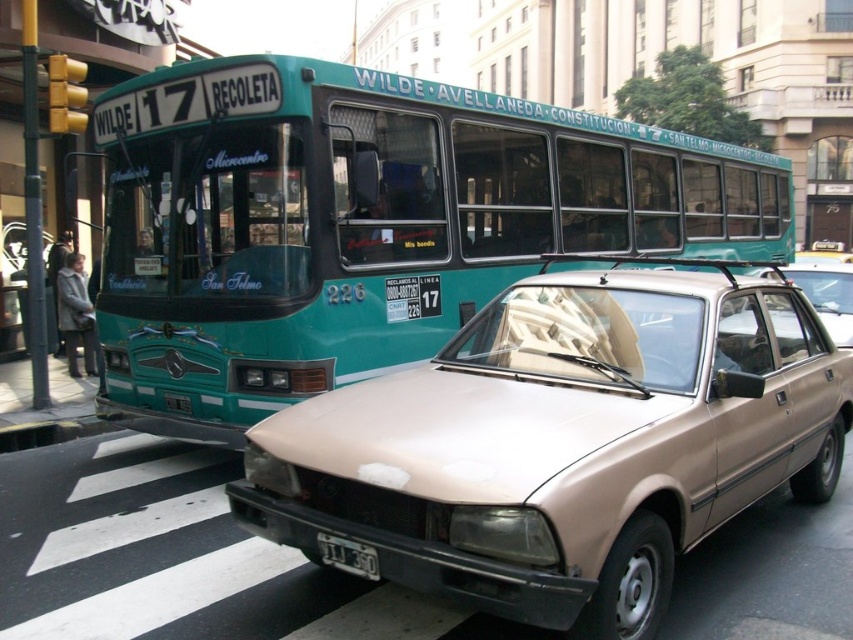
Question: Can you confirm if teal glossy bus at upper left is thinner than white plastic license plate at lower center?

Choices:
 (A) no
 (B) yes

Answer: (A)

Question: Which object is positioned closest to the white plastic license plate at lower center?

Choices:
 (A) beige matte sedan at center
 (B) teal glossy bus at upper left

Answer: (A)

Question: Is teal glossy bus at upper left bigger than beige matte sedan at center?

Choices:
 (A) no
 (B) yes

Answer: (B)

Question: Is beige matte sedan at center above white plastic license plate at lower center?

Choices:
 (A) yes
 (B) no

Answer: (A)

Question: Which object is the closest to the teal glossy bus at upper left?

Choices:
 (A) beige matte sedan at center
 (B) white plastic license plate at lower center

Answer: (A)

Question: Among these points, which one is farthest from the camera?

Choices:
 (A) (386, 268)
 (B) (357, 492)

Answer: (A)